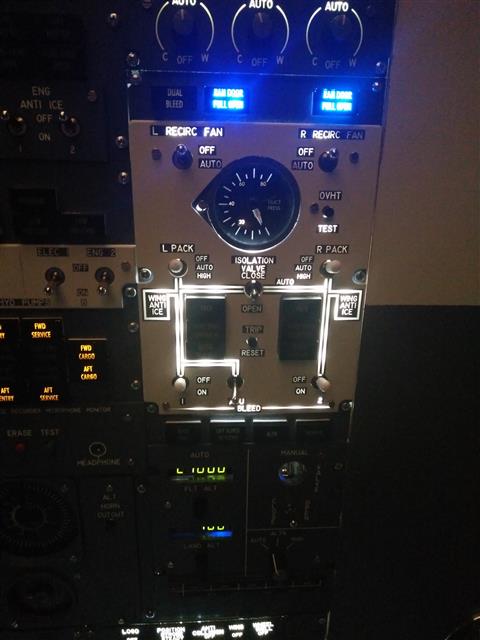
Where is `switches`? The height and width of the screenshot is (640, 480). switches is located at coordinates (103, 290), (48, 291), (252, 294), (64, 118), (13, 122).